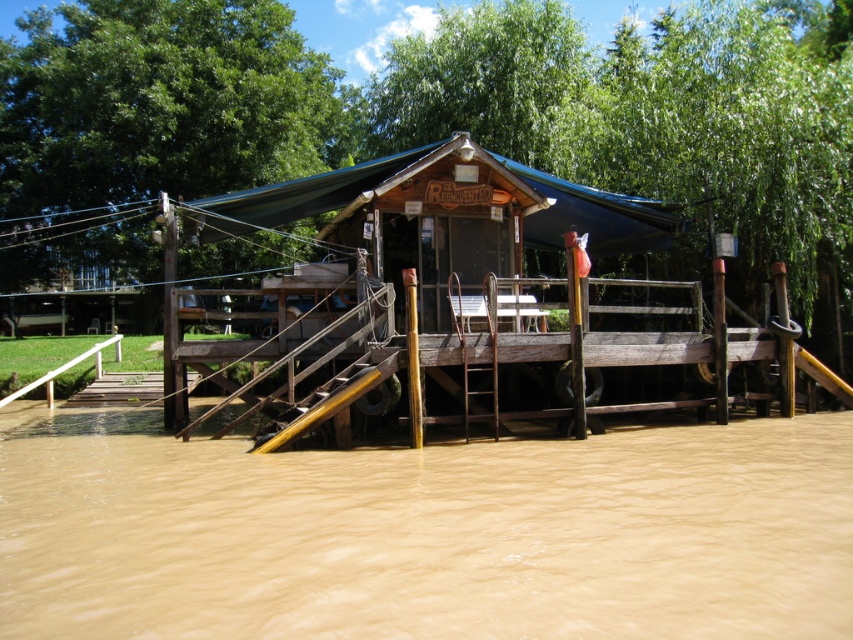
Looking at this image, you are a visitor trying to enter the Reencuentro building. You see the brown muddy water at lower center and the blue tarpaulin canopy at center. Which object is closer to you as you approach the entrance?

The brown muddy water at lower center is closer to you because it is in front of the blue tarpaulin canopy at center.

You are a visitor trying to reach the entrance of the building. You see the brown muddy water at lower center and the blue tarpaulin canopy at center. Which object is larger in size?

The brown muddy water at lower center has a smaller size compared to the blue tarpaulin canopy at center, so the blue tarpaulin canopy at center is larger in size.